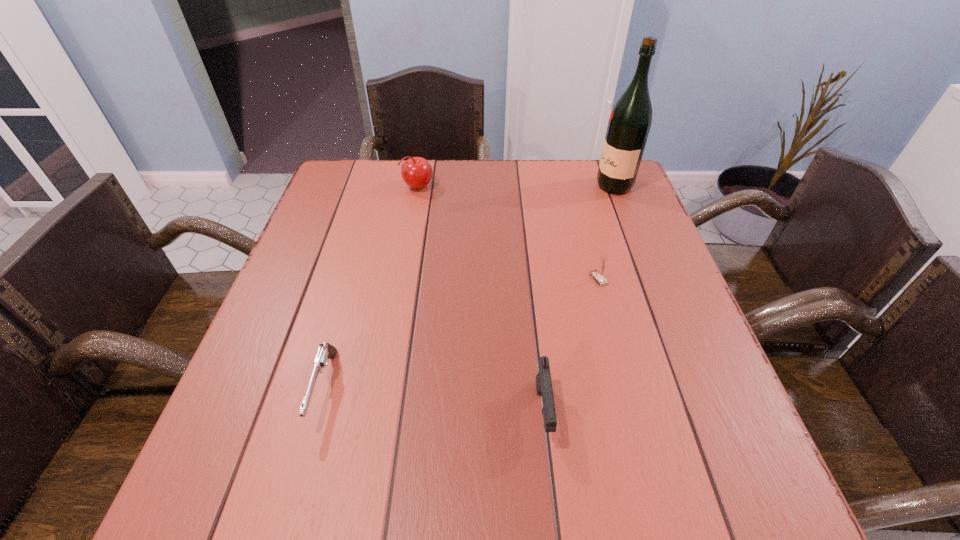
You are a GUI agent. You are given a task and a screenshot of the screen. Output one action in this format:
    pyautogui.click(x=<x>, y=<y>)
    Task: Click on the vacant position located 0.310m on the front-facing side of the liquor
    
    Given the screenshot: What is the action you would take?
    coord(490,186)

The width and height of the screenshot is (960, 540). In order to click on vacant position located on the front-facing side of the liquor in this screenshot , I will do `click(475, 186)`.

Locate an element on the screen. free space located 0.150m on the front-facing side of the liquor is located at coordinates (544, 186).

Find the location of a particular element. vacant area situated on the left of the second tallest object is located at coordinates (386, 187).

Image resolution: width=960 pixels, height=540 pixels. In order to click on vacant space located on the back of the fourth object from left to right in this screenshot , I will do click(x=586, y=228).

Find the location of a particular element. The image size is (960, 540). free space located on the front-facing side of the left pistol is located at coordinates (300, 475).

At what (x,y) coordinates should I click in order to perform the action: click on liquor that is at the far edge. Please return your answer as a coordinate pair (x, y). Looking at the image, I should click on (629, 124).

Find the location of a particular element. The width and height of the screenshot is (960, 540). cherry that is at the far edge is located at coordinates (416, 172).

The image size is (960, 540). Identify the location of object situated at the left edge. (326, 351).

Where is `liquor that is at the right edge`? Image resolution: width=960 pixels, height=540 pixels. liquor that is at the right edge is located at coordinates (x=629, y=124).